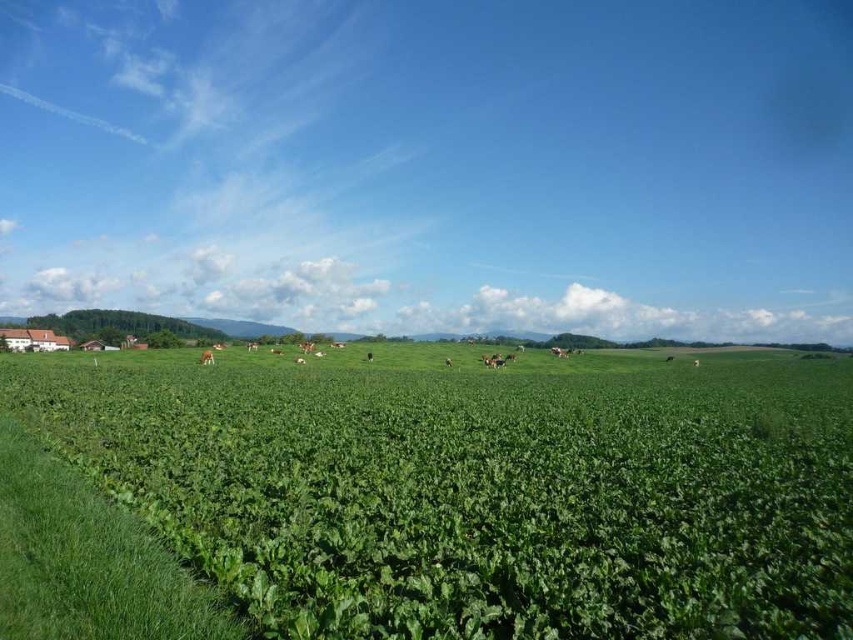
You are a farmer checking the growth of your crops and livestock. You notice the green leafy field at center and the brown furry cow at center. Which one has a taller height?

The green leafy field at center has a greater height compared to the brown furry cow at center.

You are a farmer standing in the green leafy field at center, and you need to reach the brown furry cow at center with a bucket of feed. Considering the distance between them, can you walk directly to the cow without needing to use any transportation?

The distance between the green leafy field at center and the brown furry cow at center is 163.18 meters. Walking this distance might be tiring, but it is possible without needing transportation.